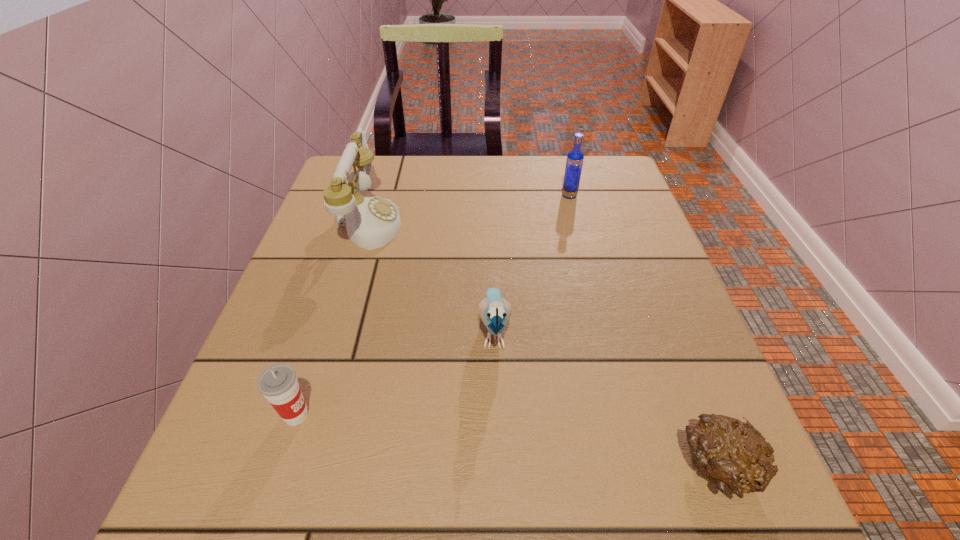
Identify the location of object at the far right corner. (574, 162).

Locate an element on the screen. The image size is (960, 540). object present at the near right corner is located at coordinates (733, 455).

Locate an element on the screen. blank space at the far edge of the desktop is located at coordinates (472, 192).

Locate an element on the screen. Image resolution: width=960 pixels, height=540 pixels. blank area at the left edge is located at coordinates (363, 282).

Find the location of `free location at the right edge of the desktop`. free location at the right edge of the desktop is located at coordinates (670, 395).

The width and height of the screenshot is (960, 540). Find the location of `free region at the far left corner`. free region at the far left corner is located at coordinates (395, 169).

The width and height of the screenshot is (960, 540). In the image, there is a desktop. What are the coordinates of `vacant space at the far right corner` in the screenshot? It's located at (620, 178).

Where is `free spot at the near right corner of the desktop`? The image size is (960, 540). free spot at the near right corner of the desktop is located at coordinates (736, 501).

Locate an element on the screen. This screenshot has height=540, width=960. free space between the second object from right to left and the rightmost object is located at coordinates (644, 332).

The width and height of the screenshot is (960, 540). Find the location of `empty space between the shortest object and the telephone`. empty space between the shortest object and the telephone is located at coordinates (544, 345).